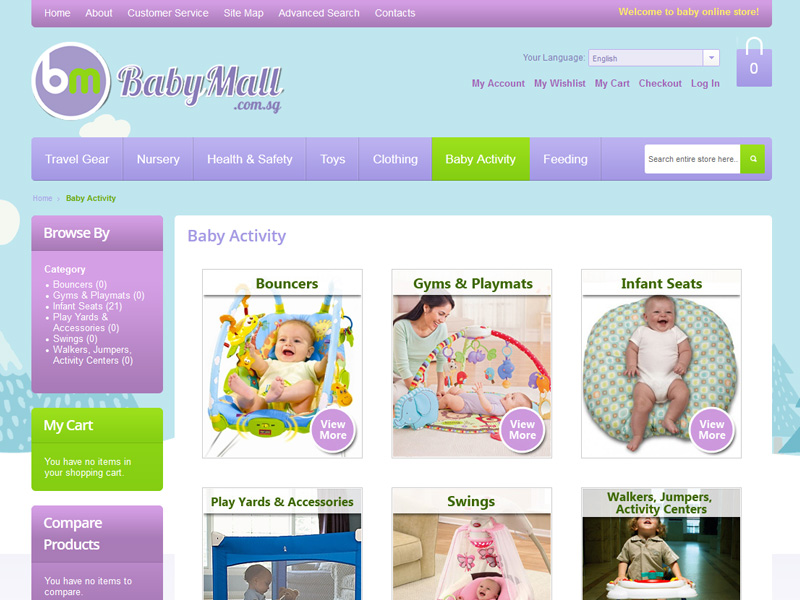
Identify the location of couch. The width and height of the screenshot is (800, 600). (402, 567).